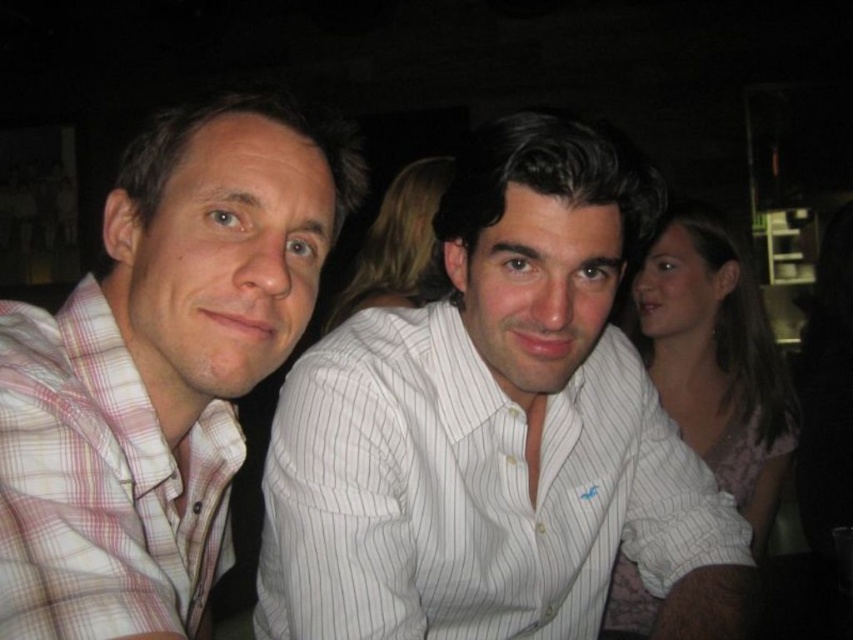
Looking at this image, you are trying to determine the relative positions of the two people in the photo. Given that the white striped shirt at center and the pink plaid shirt at left are both visible, which one is located lower in the frame?

The white striped shirt at center is positioned under the pink plaid shirt at left, meaning it is lower in the frame.

You are standing in the room and want to take a photo of the white striped shirt at center. The camera you have can only focus on objects within a 0.5 unit radius from the point you choose. If you focus on point (496, 429), will the white striped shirt at center be in focus?

The point (496, 429) is on the white striped shirt at center, so focusing there will ensure the white striped shirt at center is in focus.